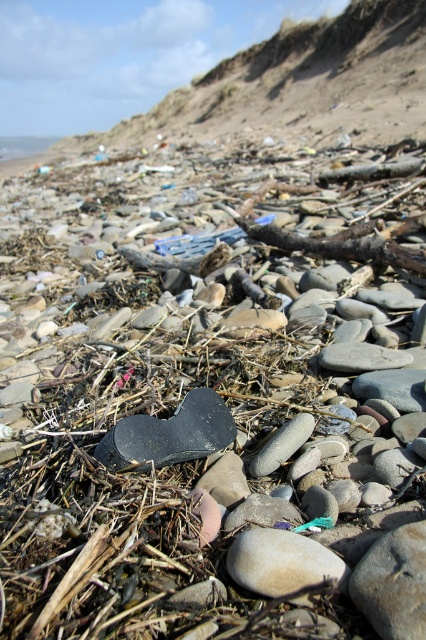
Who is positioned more to the left, black matte sandal at center or smooth gray rock at center?

black matte sandal at center is more to the left.

Can you confirm if black matte sandal at center is positioned to the left of smooth gray rock at center?

Correct, you'll find black matte sandal at center to the left of smooth gray rock at center.

Who is more distant from viewer, (183, 458) or (394, 586)?

Positioned behind is point (183, 458).

The image size is (426, 640). I want to click on black matte sandal at center, so click(x=169, y=435).

Is point (417, 547) closer to camera compared to point (301, 545)?

Yes, point (417, 547) is in front of point (301, 545).

Between point (359, 566) and point (279, 572), which one is positioned in front?

Positioned in front is point (359, 566).

Is point (397, 580) less distant than point (342, 561)?

Yes, it is.

The image size is (426, 640). Find the location of `smooth gray rock at center`. smooth gray rock at center is located at coordinates (394, 582).

Which is behind, point (170, 456) or point (273, 566)?

Point (170, 456)

Who is higher up, black matte sandal at center or smooth beige rock at center?

black matte sandal at center is higher up.

Is point (141, 419) farther from viewer compared to point (322, 563)?

That is True.

Locate an element on the screen. This screenshot has height=640, width=426. black matte sandal at center is located at coordinates (169, 435).